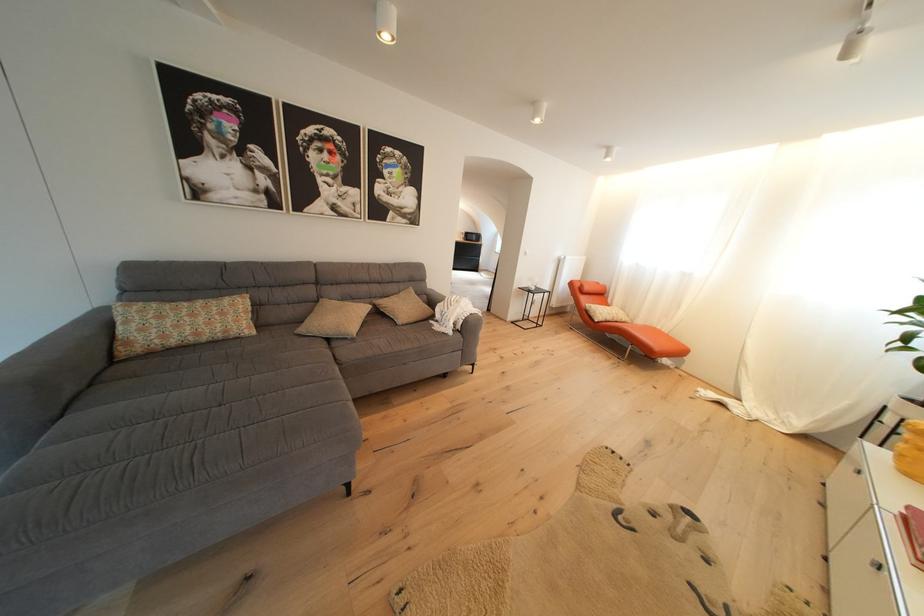
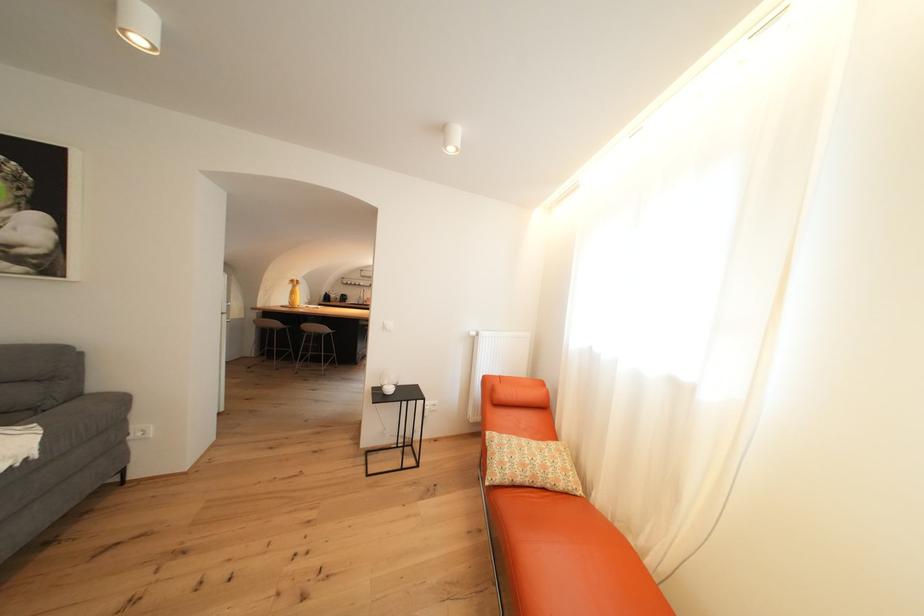
What movement of the cameraman would produce the second image?

The movement direction of the cameraman is right, forward.